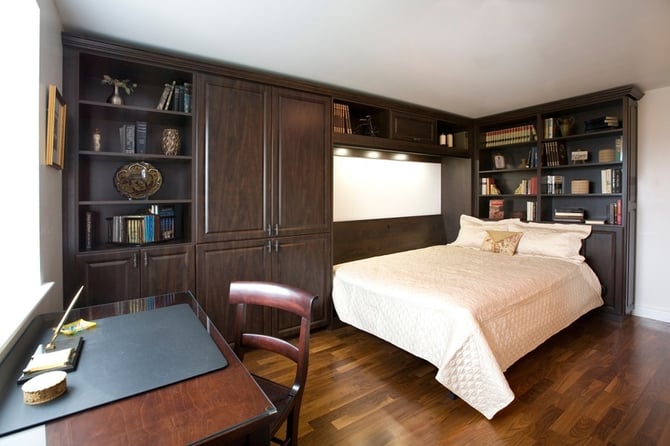
Where is `pen`? The height and width of the screenshot is (446, 670). pen is located at coordinates (67, 306).